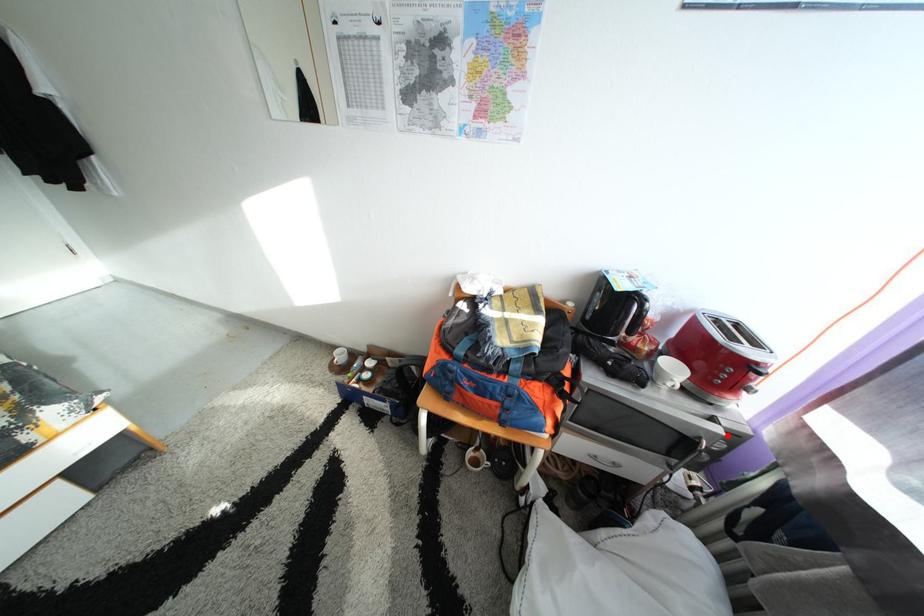
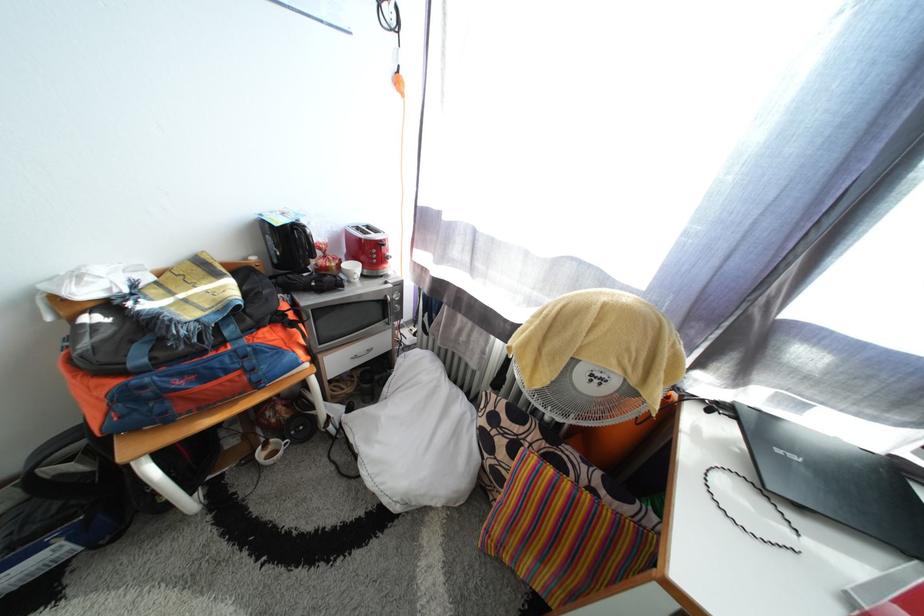
Question: I am providing you with two images of the same scene from different viewpoints. A red point is shown in image1. For the corresponding object point in image2, is it positioned nearer or farther from the camera?

Choices:
 (A) Nearer
 (B) Farther

Answer: (A)